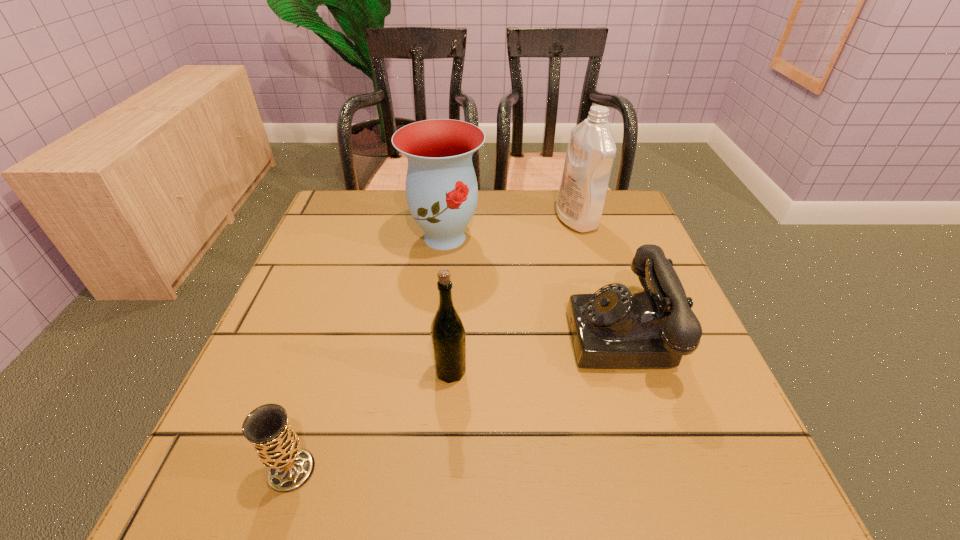
Locate an element on the screen. This screenshot has width=960, height=540. free space located 0.050m on the dial of the second shortest object is located at coordinates (543, 333).

This screenshot has width=960, height=540. In order to click on free location located 0.120m on the dial of the second shortest object in this screenshot , I will do `click(507, 333)`.

Locate an element on the screen. blank space located 0.110m on the back of the leftmost object is located at coordinates (319, 388).

Where is `detergent that is at the far edge`? The image size is (960, 540). detergent that is at the far edge is located at coordinates (591, 150).

Identify the location of vase at the far edge. This screenshot has height=540, width=960. [441, 187].

You are a GUI agent. You are given a task and a screenshot of the screen. Output one action in this format:
    pyautogui.click(x=<x>, y=<y>)
    Task: Click on the object at the near edge
    This screenshot has width=960, height=540.
    Given the screenshot: What is the action you would take?
    pyautogui.click(x=277, y=445)

Identify the location of object present at the left edge. (x=277, y=445).

I want to click on detergent that is at the right edge, so click(x=591, y=150).

The image size is (960, 540). In order to click on telephone at the right edge in this screenshot , I will do `click(613, 328)`.

Where is `object that is at the near left corner`? object that is at the near left corner is located at coordinates (277, 445).